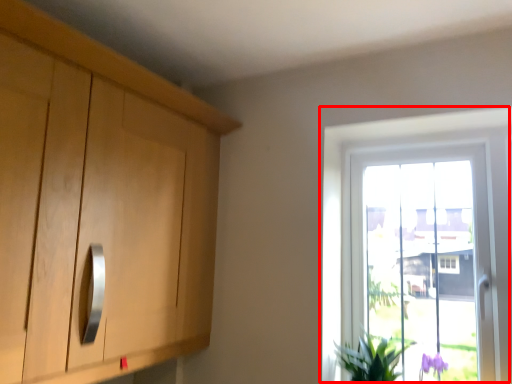
Question: From the image's perspective, considering the relative positions of window (annotated by the red box) and houseplant in the image provided, where is window (annotated by the red box) located with respect to the staircase?

Choices:
 (A) below
 (B) above

Answer: (B)